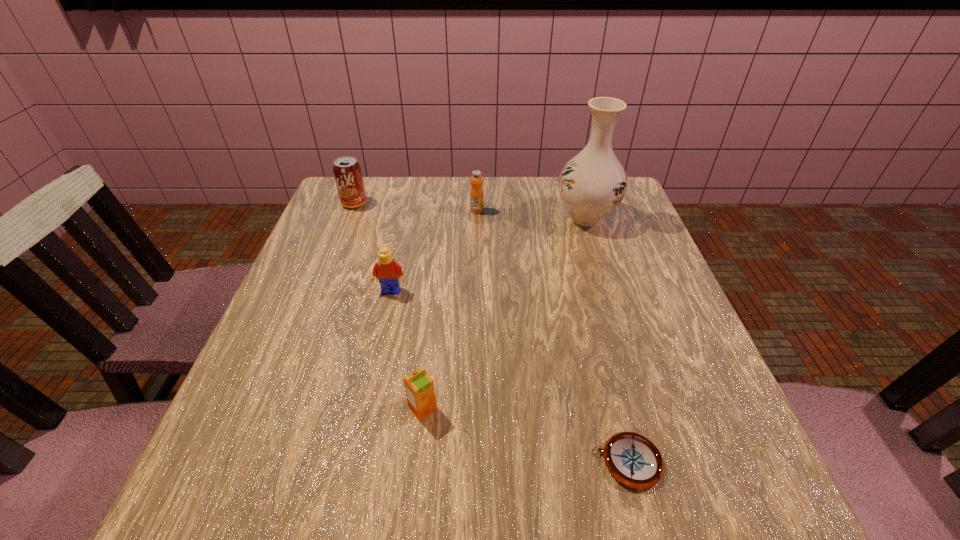
I want to click on unoccupied area between the tallest object and the third object from left to right, so click(x=504, y=313).

Locate an element on the screen. empty space between the leftmost object and the fifth tallest object is located at coordinates pos(389,306).

Find the location of a particular element. object that is the fifth closest to the shortest object is located at coordinates (347, 171).

At what (x,y) coordinates should I click in order to perform the action: click on the closest object relative to the fourth object from right to left. Please return your answer as a coordinate pair (x, y). This screenshot has height=540, width=960. Looking at the image, I should click on (632, 459).

You are a GUI agent. You are given a task and a screenshot of the screen. Output one action in this format:
    pyautogui.click(x=<x>, y=<y>)
    Task: Click on the vacant area that satisfies the following two spatial constraints: 1. on the front-facing side of the left orange juice; 2. on the right side of the second object from left to right
    
    Given the screenshot: What is the action you would take?
    pyautogui.click(x=366, y=408)

This screenshot has width=960, height=540. I want to click on vacant space that satisfies the following two spatial constraints: 1. on the front label of the right orange juice; 2. on the left side of the tallest object, so click(477, 217).

Where is `free spot that satisfies the following two spatial constraints: 1. on the front label of the vase; 2. on the left side of the farther orange juice`? The image size is (960, 540). free spot that satisfies the following two spatial constraints: 1. on the front label of the vase; 2. on the left side of the farther orange juice is located at coordinates (477, 217).